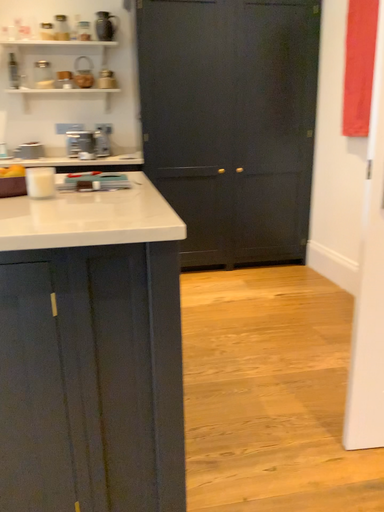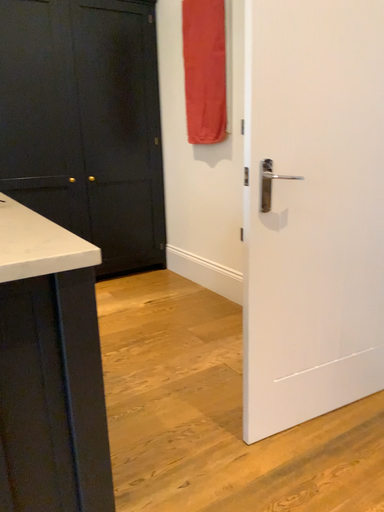
Question: Which way did the camera rotate in the video?

Choices:
 (A) rotated right
 (B) rotated left

Answer: (A)